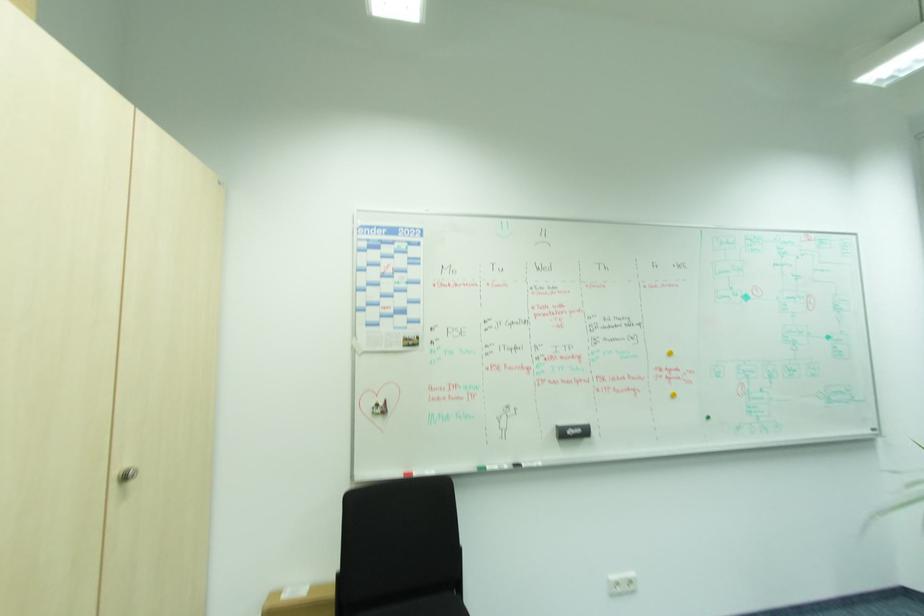
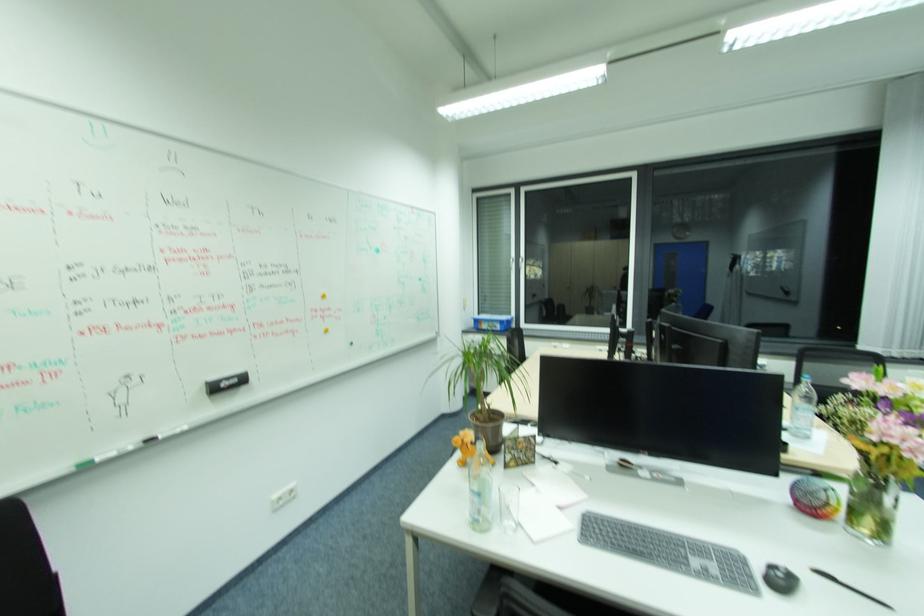
In the second image, find the point that corresponds to the point at 676,354 in the first image.

(329, 296)